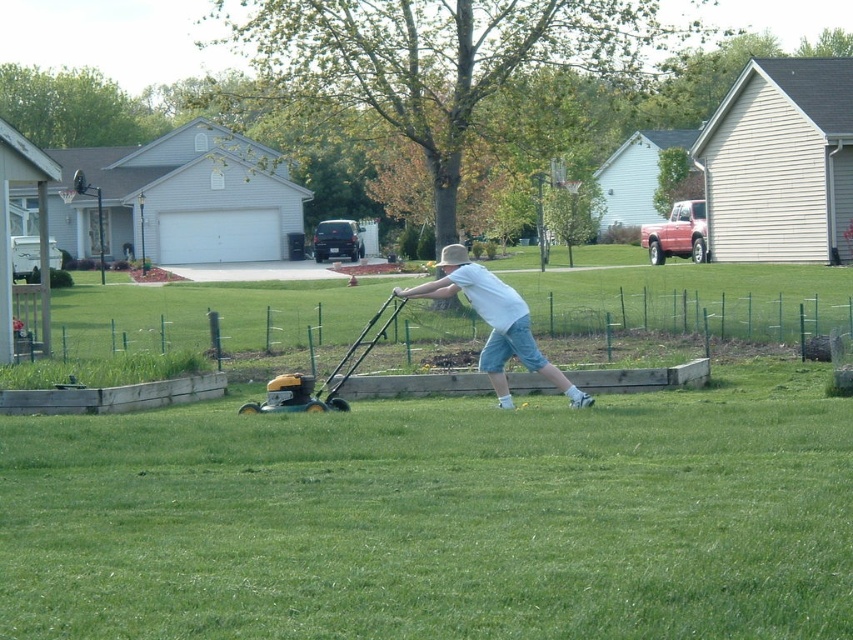
You are standing at the point with coordinates point (x=616, y=545) and want to walk towards the point (x=445, y=246). According to the scene, will you be moving towards the basketball hoop mounted on the pole near the left side of the frame?

Yes, because point (x=616, y=545) is in front of point (x=445, y=246), so moving from point (x=616, y=545) towards point (x=445, y=246) would mean moving towards the basketball hoop mounted on the pole near the left side of the frame.

You are trying to decide where to place a new garden bench. The bench is 1.2 meters wide. Based on the scene, which object from the list below has enough width to accommodate the bench? Choose between the green grass at center and the white cotton shirt at center.

The green grass at center is wider than the white cotton shirt at center, so the green grass at center can accommodate the 1.2 meter wide bench.